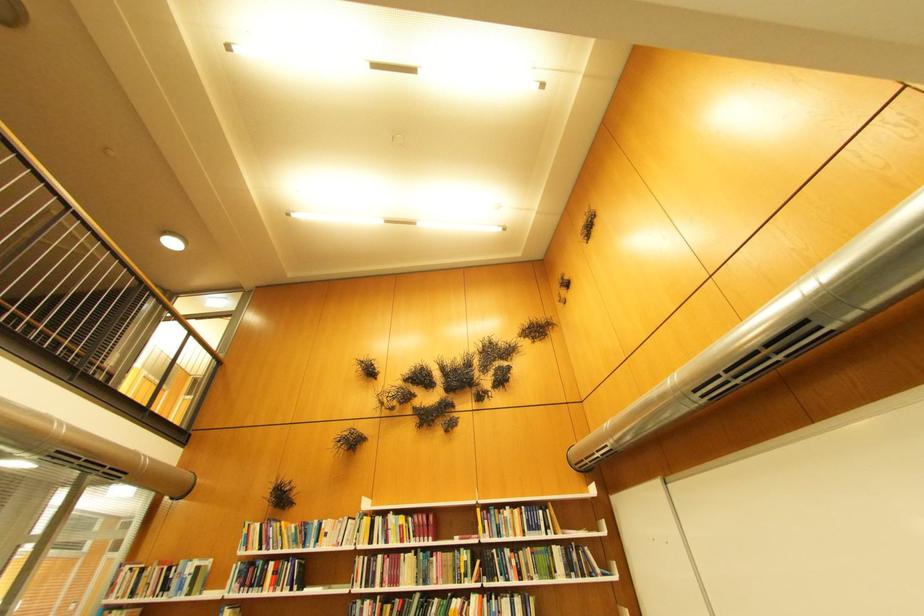
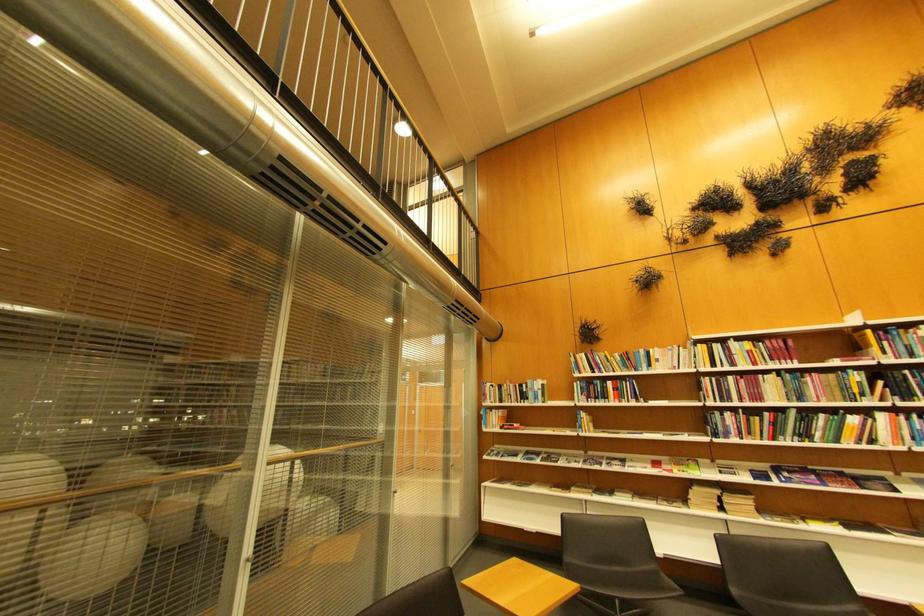
Find the pixel in the second image that matches (x=489, y=512) in the first image.

(880, 333)